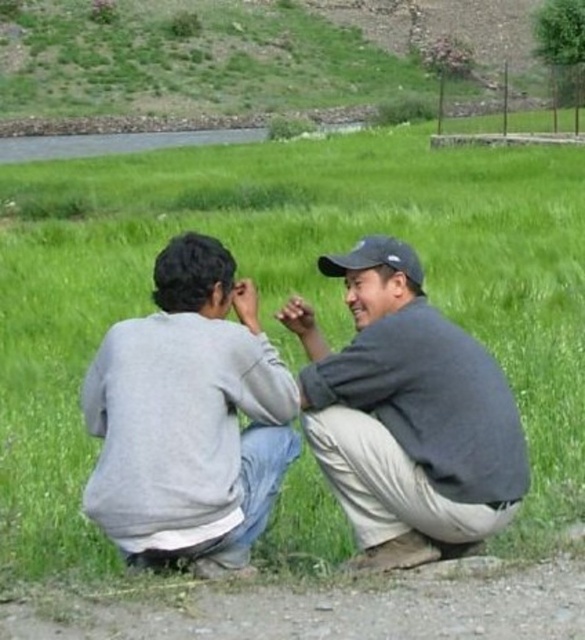
Question: Does gray cotton shirt at center have a smaller size compared to black fabric baseball cap at center?

Choices:
 (A) no
 (B) yes

Answer: (B)

Question: Is gray cotton shirt at center wider than black fabric baseball cap at center?

Choices:
 (A) yes
 (B) no

Answer: (A)

Question: Can you confirm if gray cotton shirt at center is wider than black fabric baseball cap at center?

Choices:
 (A) yes
 (B) no

Answer: (A)

Question: Among these points, which one is nearest to the camera?

Choices:
 (A) 363,240
 (B) 228,497

Answer: (B)

Question: Which point is farther to the camera?

Choices:
 (A) gray cotton sweatshirt at center
 (B) black fabric baseball cap at center
 (C) gray cotton shirt at center

Answer: (B)

Question: Which object is positioned closest to the gray cotton shirt at center?

Choices:
 (A) gray cotton sweatshirt at center
 (B) black fabric baseball cap at center

Answer: (A)